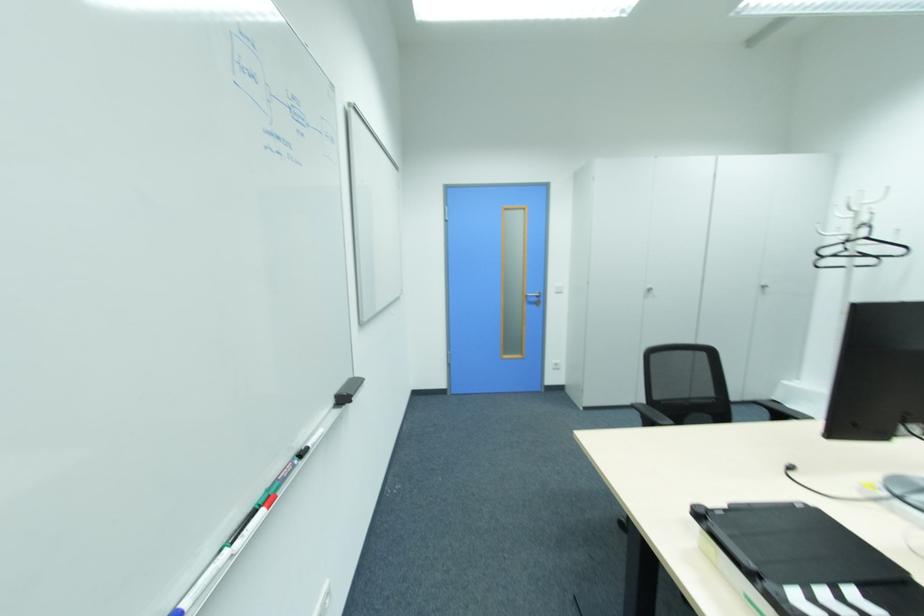
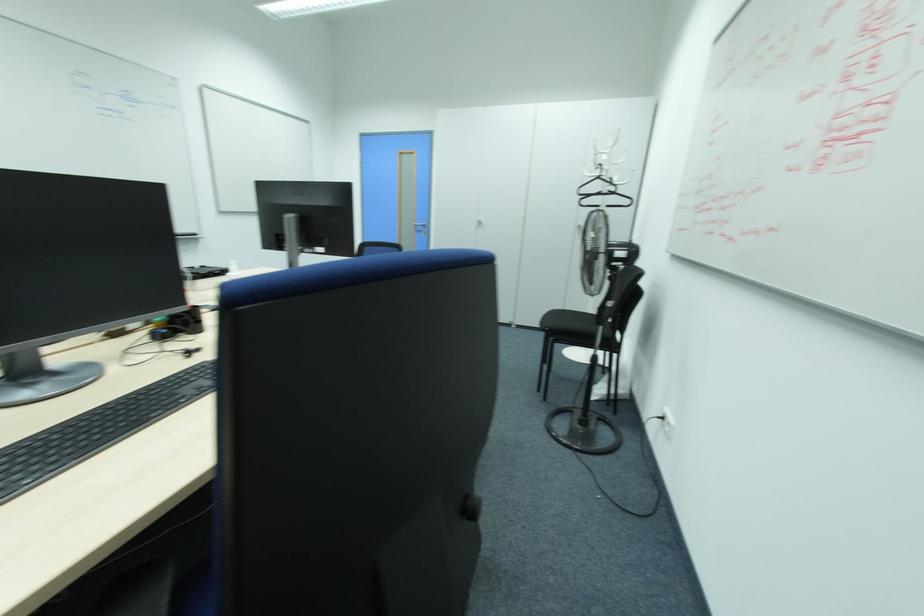
Question: In a continuous first-person perspective shot, in which direction is the camera moving?

Choices:
 (A) Left
 (B) Right
 (C) Forward
 (D) Backward

Answer: (B)